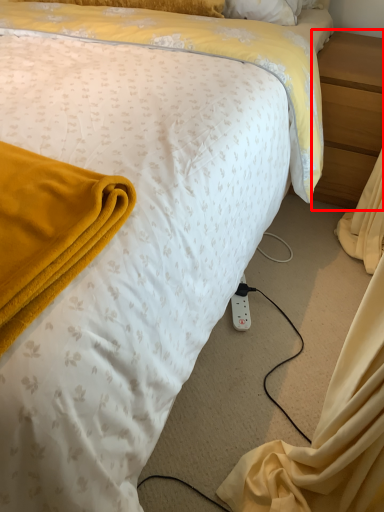
Question: From the image, what is the correct spatial relationship of nightstand (annotated by the red box) in relation to power outlet?

Choices:
 (A) left
 (B) right

Answer: (B)